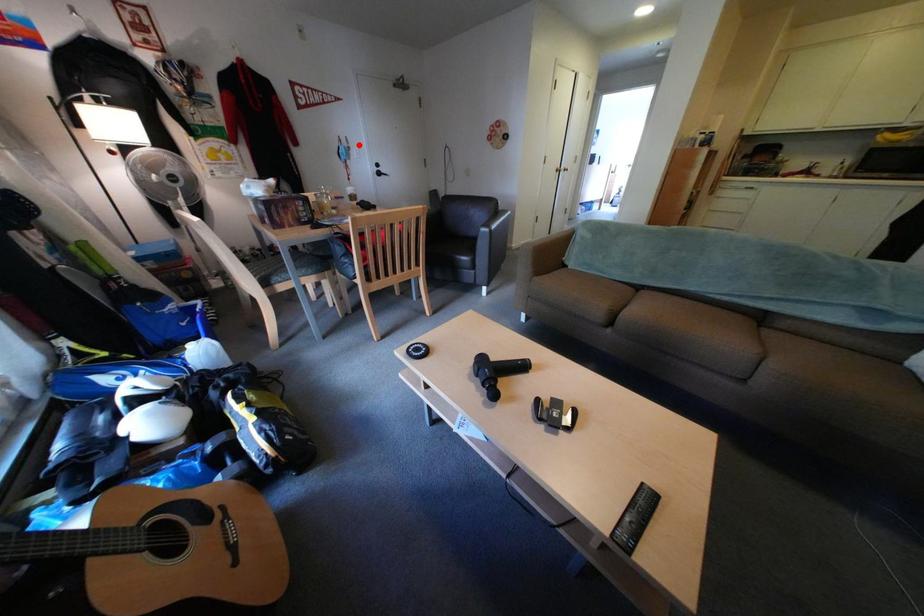
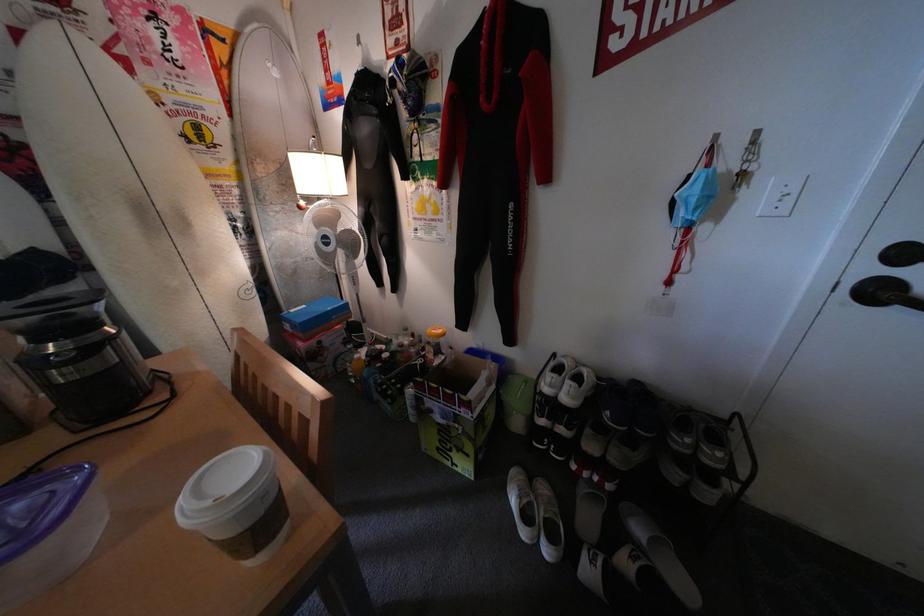
Question: I am providing you with two images of the same scene from different viewpoints. Given a red point in image1, look at the same physical point in image2. Is it:

Choices:
 (A) Closer to the viewpoint
 (B) Farther from the viewpoint

Answer: (B)